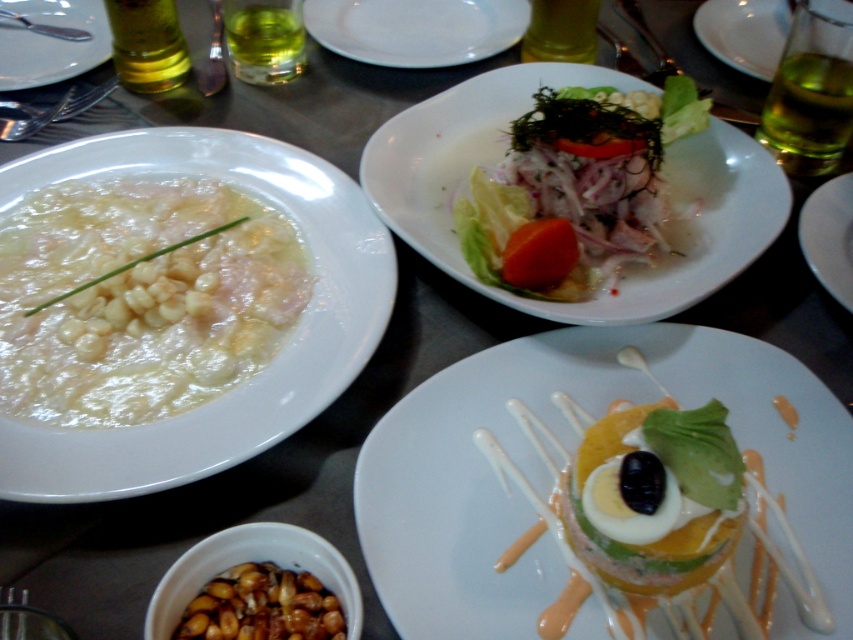
Question: Based on their relative distances, which object is nearer to the white glossy plate at center?

Choices:
 (A) brown glossy nuts at lower left
 (B) white creamy soup at upper center
 (C) white glossy dessert at center

Answer: (B)

Question: Which object appears closest to the camera in this image?

Choices:
 (A) white glossy plate at upper center
 (B) white glossy plate at center
 (C) brown glossy nuts at lower left
 (D) white creamy soup at left

Answer: (C)

Question: Which of these objects is positioned farthest from the brown glossy nuts at lower left?

Choices:
 (A) white glossy plate at upper center
 (B) white creamy soup at left
 (C) white creamy soup at upper center

Answer: (A)

Question: Is white creamy soup at upper center below matte white plate at upper right?

Choices:
 (A) yes
 (B) no

Answer: (A)

Question: In this image, where is white glossy plate at upper center located relative to white glossy plate at upper left?

Choices:
 (A) left
 (B) right

Answer: (B)

Question: Does white porcelain plate at upper center have a greater width compared to matte white plate at upper right?

Choices:
 (A) no
 (B) yes

Answer: (B)